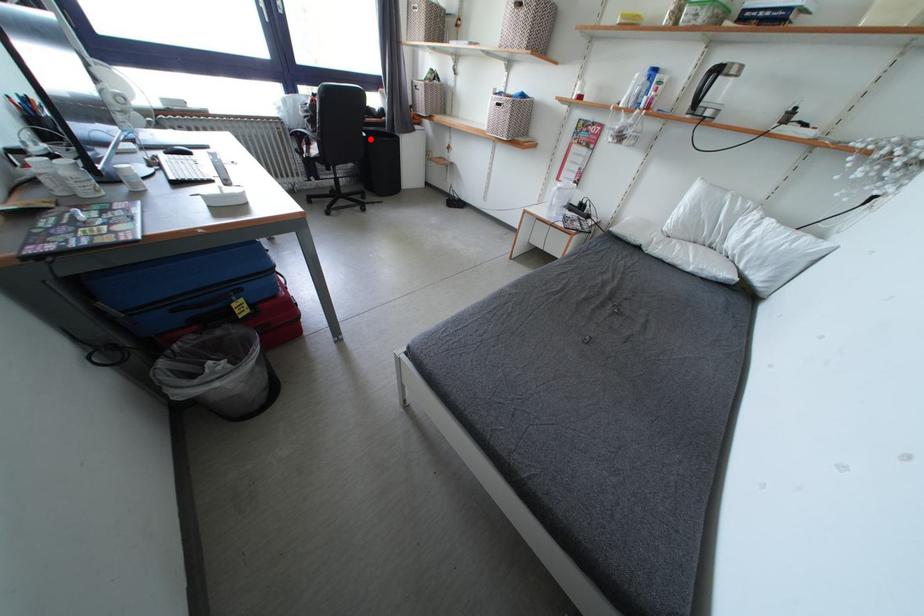
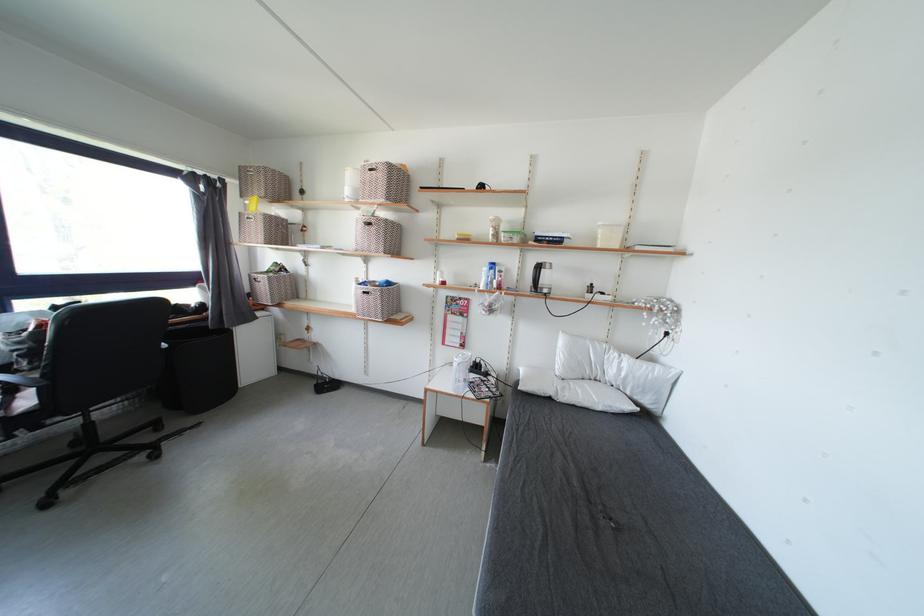
Find the pixel in the second image that matches the highlighted location in the first image.

(171, 350)